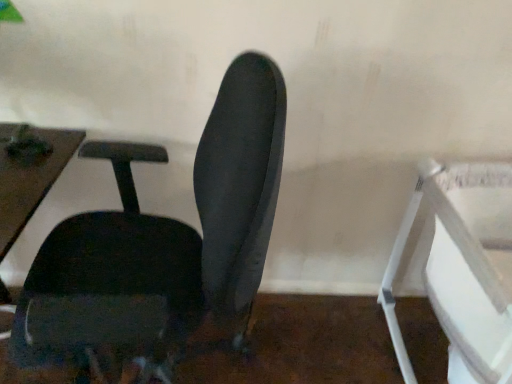
What is the approximate height of matte black chair at center?

matte black chair at center is 1.09 meters tall.

Where is `matte black chair at center`? The width and height of the screenshot is (512, 384). matte black chair at center is located at coordinates (163, 243).

Describe the element at coordinates (163, 243) in the screenshot. I see `matte black chair at center` at that location.

The width and height of the screenshot is (512, 384). What do you see at coordinates (463, 267) in the screenshot?
I see `white plastic feeding chair at right` at bounding box center [463, 267].

Locate an element on the screen. white plastic feeding chair at right is located at coordinates (463, 267).

What are the coordinates of `matte black chair at center` in the screenshot? It's located at (163, 243).

Considering the positions of objects white plastic feeding chair at right and matte black chair at center in the image provided, who is more to the right, white plastic feeding chair at right or matte black chair at center?

From the viewer's perspective, white plastic feeding chair at right appears more on the right side.

Which object is further away from the camera, white plastic feeding chair at right or matte black chair at center?

white plastic feeding chair at right is more distant.

Is point (453, 327) closer or farther from the camera than point (234, 171)?

Point (453, 327) is positioned farther from the camera compared to point (234, 171).

From the image's perspective, is white plastic feeding chair at right under matte black chair at center?

Yes, from the image's perspective, white plastic feeding chair at right is below matte black chair at center.

In the scene shown: From a real-world perspective, which object rests below the other?

white plastic feeding chair at right is physically lower.

Can you confirm if white plastic feeding chair at right is wider than matte black chair at center?

Yes.

Which of these two, white plastic feeding chair at right or matte black chair at center, stands taller?

matte black chair at center is taller.

Which of these two, white plastic feeding chair at right or matte black chair at center, is smaller?

Smaller between the two is white plastic feeding chair at right.

Would you say white plastic feeding chair at right is inside or outside matte black chair at center?

white plastic feeding chair at right is spatially situated outside matte black chair at center.

Does white plastic feeding chair at right touch matte black chair at center?

No, white plastic feeding chair at right is not next to matte black chair at center.

Is white plastic feeding chair at right facing towards matte black chair at center?

No.

Find the location of a particular element. The height and width of the screenshot is (384, 512). chair in front of the white plastic feeding chair at right is located at coordinates (163, 243).

Can you confirm if matte black chair at center is positioned to the left of white plastic feeding chair at right?

Indeed, matte black chair at center is positioned on the left side of white plastic feeding chair at right.

Is matte black chair at center positioned behind white plastic feeding chair at right?

No, the depth of matte black chair at center is less than that of white plastic feeding chair at right.

Which is closer to the camera, (x=246, y=246) or (x=501, y=309)?

The point (x=246, y=246) is in front.

In the scene shown: From the image's perspective, between matte black chair at center and white plastic feeding chair at right, which one is located above?

matte black chair at center.

From a real-world perspective, relative to white plastic feeding chair at right, is matte black chair at center vertically above or below?

From a real-world perspective, matte black chair at center is physically above white plastic feeding chair at right.

Which of these two, matte black chair at center or white plastic feeding chair at right, is wider?

With larger width is white plastic feeding chair at right.

Considering the sizes of objects matte black chair at center and white plastic feeding chair at right in the image provided, who is shorter, matte black chair at center or white plastic feeding chair at right?

With less height is white plastic feeding chair at right.

Does matte black chair at center have a larger size compared to white plastic feeding chair at right?

Correct, matte black chair at center is larger in size than white plastic feeding chair at right.

Is matte black chair at center spatially inside white plastic feeding chair at right, or outside of it?

matte black chair at center is not enclosed by white plastic feeding chair at right.

Is there a large distance between matte black chair at center and white plastic feeding chair at right?

No, matte black chair at center is in close proximity to white plastic feeding chair at right.

Is matte black chair at center looking in the opposite direction of white plastic feeding chair at right?

Yes, white plastic feeding chair at right is at the back of matte black chair at center.

How many degrees apart are the facing directions of matte black chair at center and white plastic feeding chair at right?

They differ by 91 degrees in their facing directions.

How much distance is there between matte black chair at center and white plastic feeding chair at right?

They are 28.74 inches apart.

You are a GUI agent. You are given a task and a screenshot of the screen. Output one action in this format:
    pyautogui.click(x=<x>, y=<y>)
    Task: Click on the chair on the left of white plastic feeding chair at right
    
    Given the screenshot: What is the action you would take?
    pyautogui.click(x=163, y=243)

Image resolution: width=512 pixels, height=384 pixels. I want to click on chair to the left of white plastic feeding chair at right, so click(x=163, y=243).

The height and width of the screenshot is (384, 512). I want to click on feeding chair on the right of the matte black chair at center, so click(463, 267).